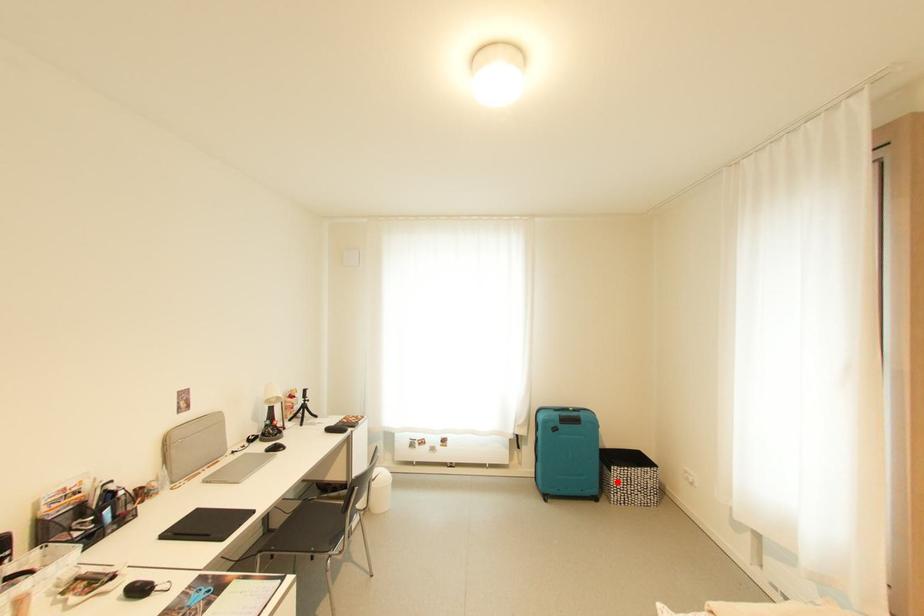
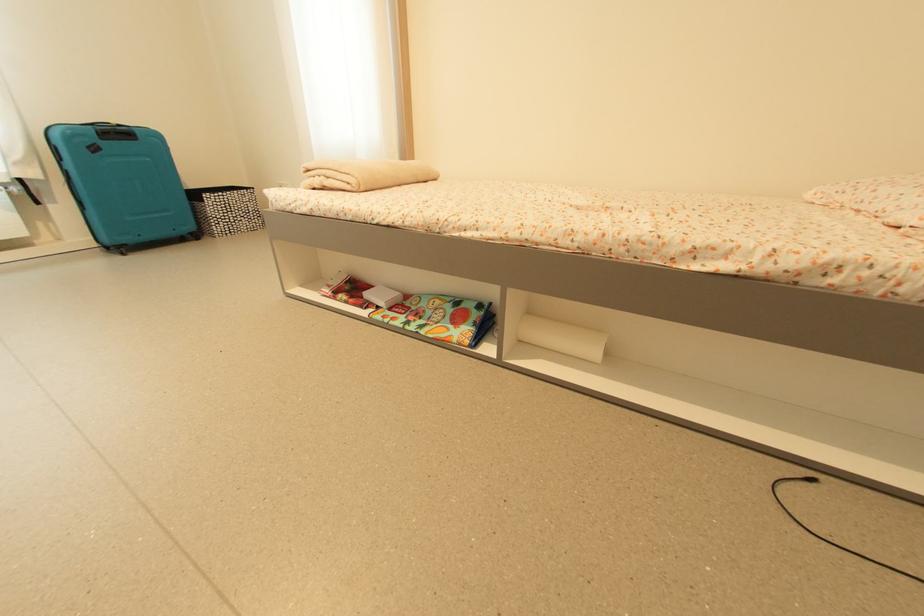
Question: I am providing you with two images of the same scene from different viewpoints. Given a red point in image1, look at the same physical point in image2. Is it:

Choices:
 (A) Closer to the viewpoint
 (B) Farther from the viewpoint

Answer: (A)